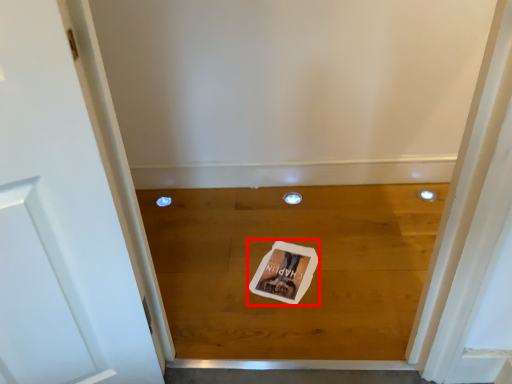
Question: From the image's perspective, what is the correct spatial positioning of postcard (annotated by the red box) in reference to plank?

Choices:
 (A) above
 (B) below

Answer: (B)